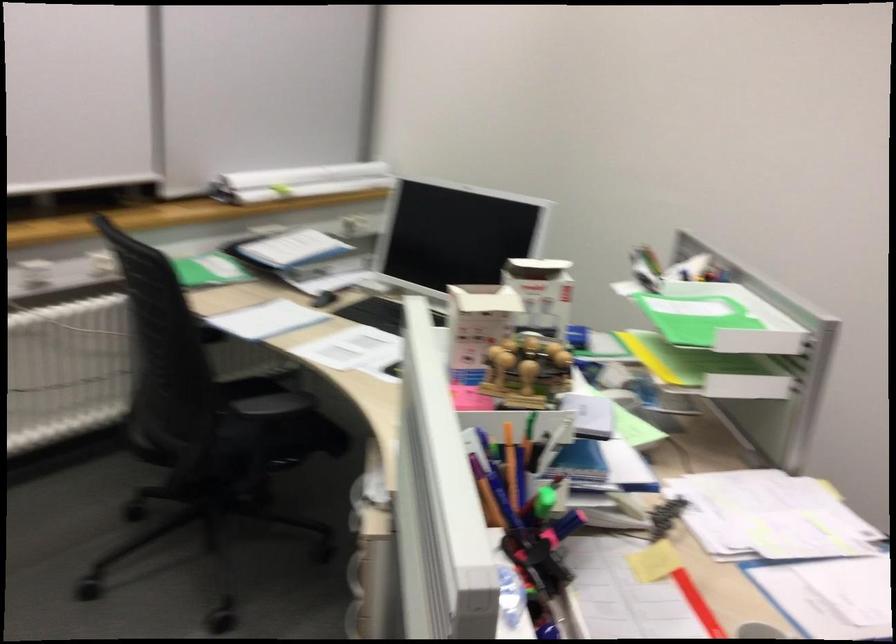
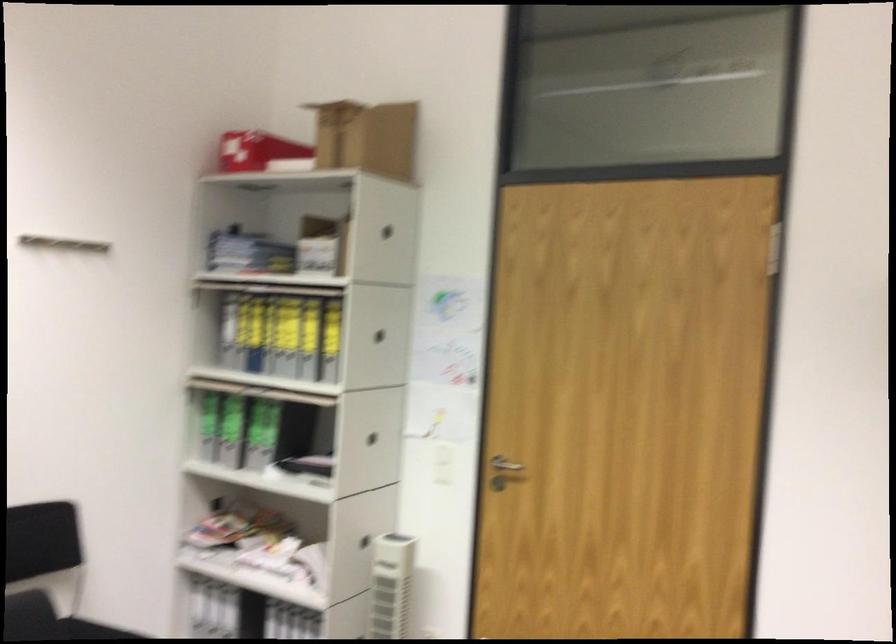
Question: The images are taken continuously from a first-person perspective. In which direction is your viewpoint rotating?

Choices:
 (A) Left
 (B) Right
 (C) Up
 (D) Down

Answer: (B)